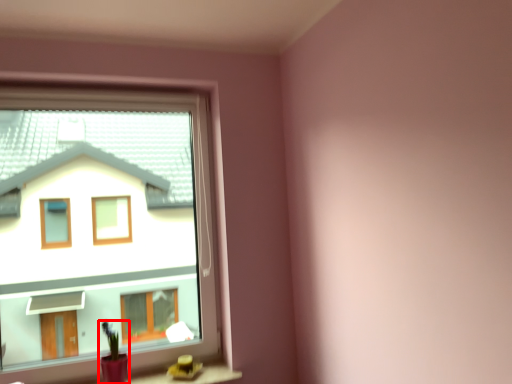
Question: From the image's perspective, where is houseplant (annotated by the red box) located in relation to window in the image?

Choices:
 (A) above
 (B) below

Answer: (B)